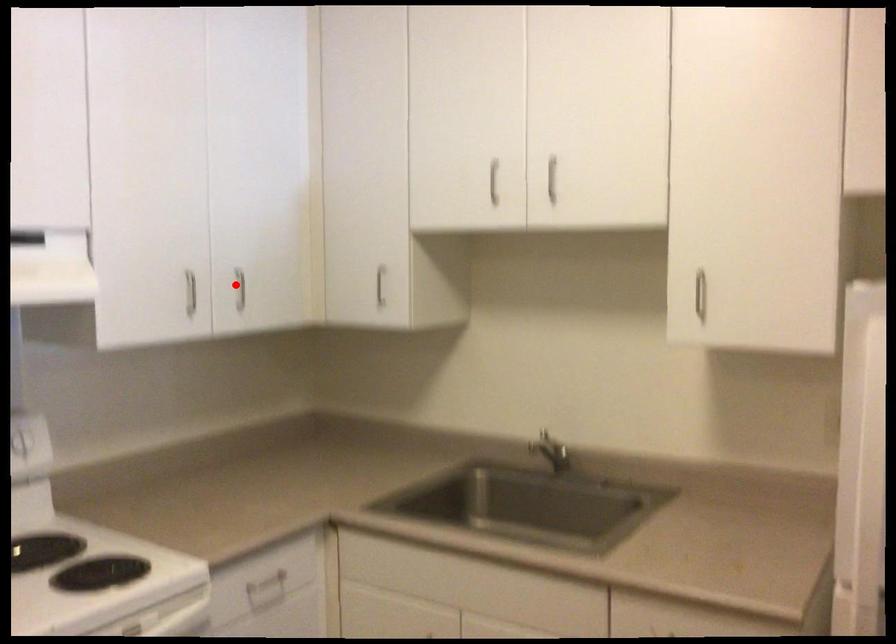
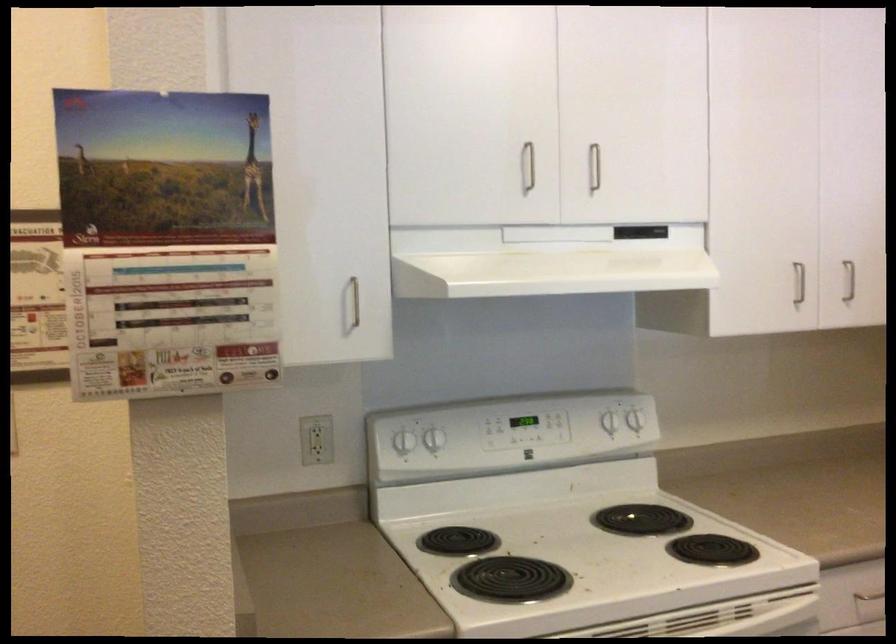
In the second image, find the point that corresponds to the highlighted location in the first image.

(849, 281)